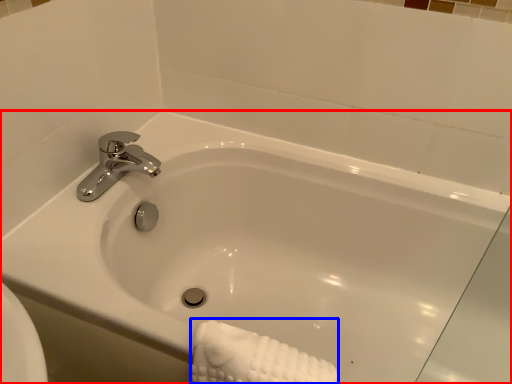
Question: Which object is further to the camera taking this photo, bathtub (highlighted by a red box) or bath towel (highlighted by a blue box)?

Choices:
 (A) bathtub
 (B) bath towel

Answer: (B)